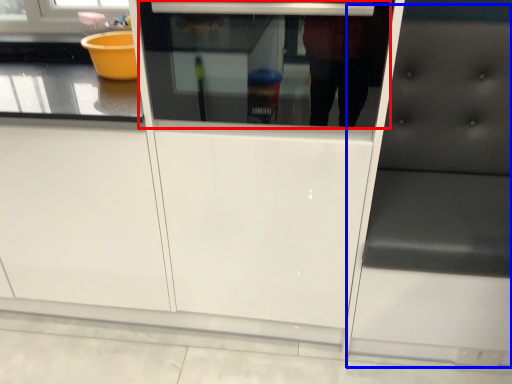
Question: Which point is closer to the camera, oven (highlighted by a red box) or furniture (highlighted by a blue box)?

Choices:
 (A) oven
 (B) furniture

Answer: (B)